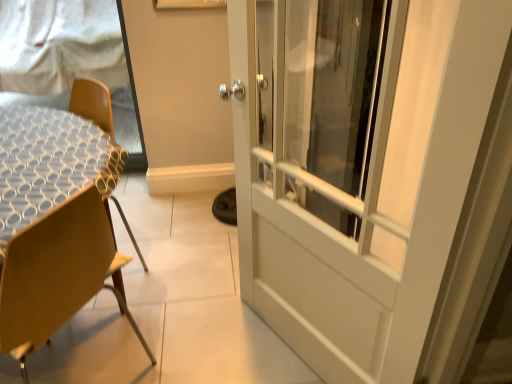
Image resolution: width=512 pixels, height=384 pixels. What are the coordinates of `vacant space to the right of white textured table at left` in the screenshot? It's located at (170, 269).